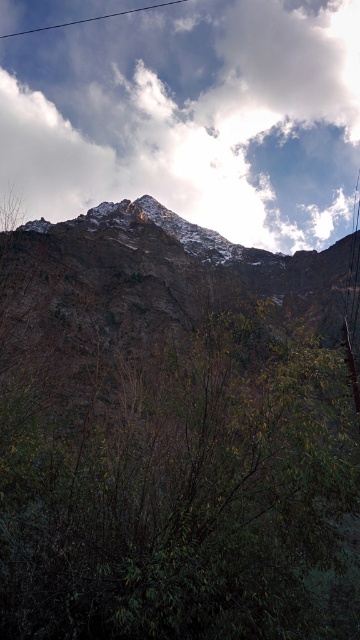
Question: Is green leafy tree at center above rugged stone mountain range at center?

Choices:
 (A) yes
 (B) no

Answer: (B)

Question: Can you confirm if white fluffy cloud at upper center is positioned to the right of rugged stone mountain range at center?

Choices:
 (A) yes
 (B) no

Answer: (B)

Question: Does white fluffy cloud at upper center appear on the right side of rugged stone mountain range at center?

Choices:
 (A) yes
 (B) no

Answer: (B)

Question: Which point appears farthest from the camera in this image?

Choices:
 (A) tap(95, 48)
 (B) tap(90, 285)
 (C) tap(51, 368)

Answer: (A)

Question: Estimate the real-world distances between objects in this image. Which object is farther from the white fluffy cloud at upper center?

Choices:
 (A) green leafy tree at center
 (B) rugged stone mountain range at center

Answer: (A)

Question: Which is nearer to the white fluffy cloud at upper center?

Choices:
 (A) rugged stone mountain range at center
 (B) green leafy tree at center

Answer: (A)